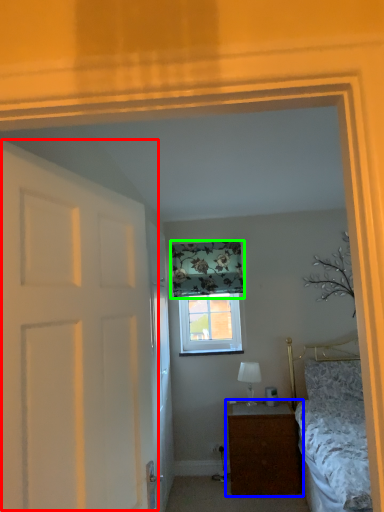
Question: Which object is the closest to the door (highlighted by a red box)? Choose among these: nightstand (highlighted by a blue box) or curtain (highlighted by a green box).

Choices:
 (A) nightstand
 (B) curtain

Answer: (A)